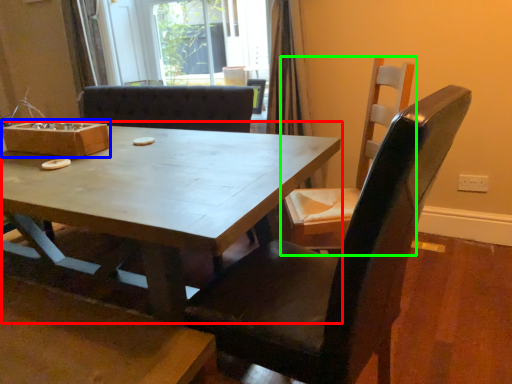
Question: Estimate the real-world distances between objects in this image. Which object is farther from coffee table (highlighted by a red box), box (highlighted by a blue box) or chair (highlighted by a green box)?

Choices:
 (A) box
 (B) chair

Answer: (B)